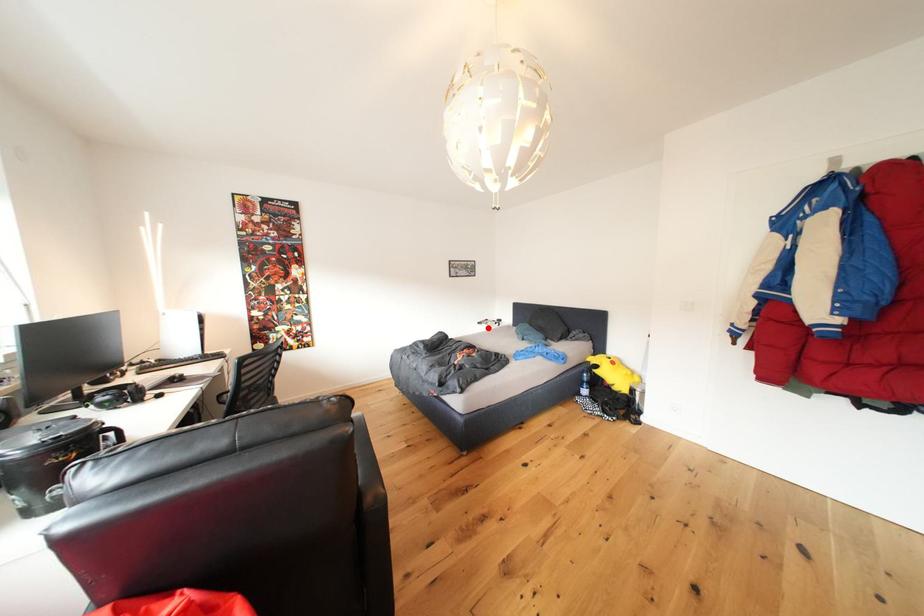
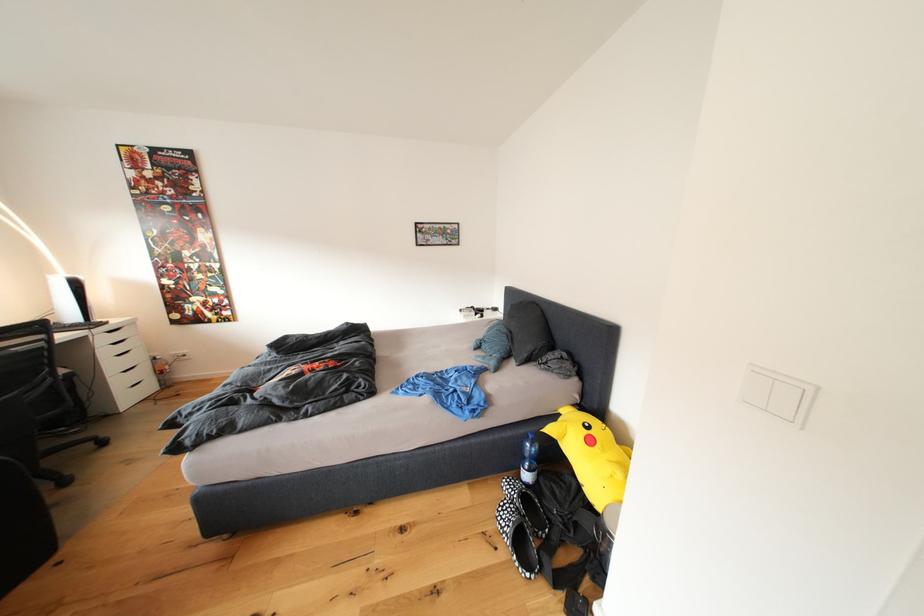
In the second image, find the point that corresponds to the highlighted location in the first image.

(469, 315)